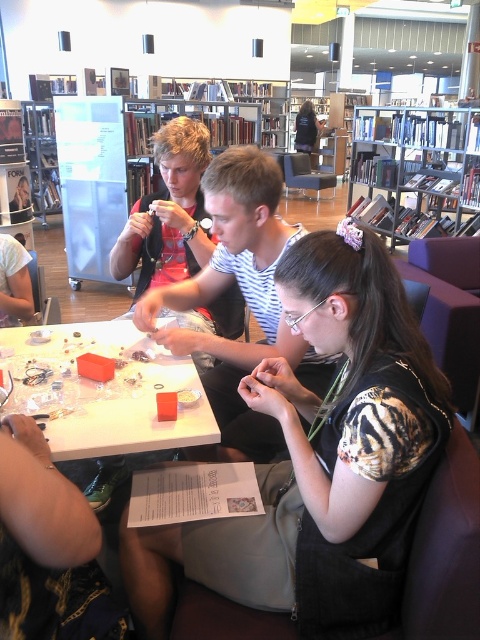
Between point (195, 412) and point (307, 141), which one is positioned in front?

Point (195, 412) is in front.

Consider the image. Which is more to the left, white plastic table at center or dark blue shirt at center?

white plastic table at center is more to the left.

Find the location of a particular element. This screenshot has width=480, height=640. white plastic table at center is located at coordinates (104, 394).

Find the location of a particular element. Image resolution: width=480 pixels, height=640 pixels. white plastic table at center is located at coordinates (104, 394).

Does matte black shirt at center have a larger size compared to metallic silver bookshelf at upper right?

No.

Does matte black shirt at center have a smaller size compared to metallic silver bookshelf at upper right?

Yes, matte black shirt at center is smaller than metallic silver bookshelf at upper right.

Locate an element on the screen. matte black shirt at center is located at coordinates (321, 458).

The image size is (480, 640). What are the coordinates of `matte black shirt at center` in the screenshot? It's located at (321, 458).

Does metallic silver bookshelf at upper right appear under dark blue shirt at center?

Yes.

Is metallic silver bookshelf at upper right smaller than dark blue shirt at center?

Actually, metallic silver bookshelf at upper right might be larger than dark blue shirt at center.

The height and width of the screenshot is (640, 480). Find the location of `metallic silver bookshelf at upper right`. metallic silver bookshelf at upper right is located at coordinates (417, 170).

The height and width of the screenshot is (640, 480). I want to click on metallic silver bookshelf at upper right, so click(417, 170).